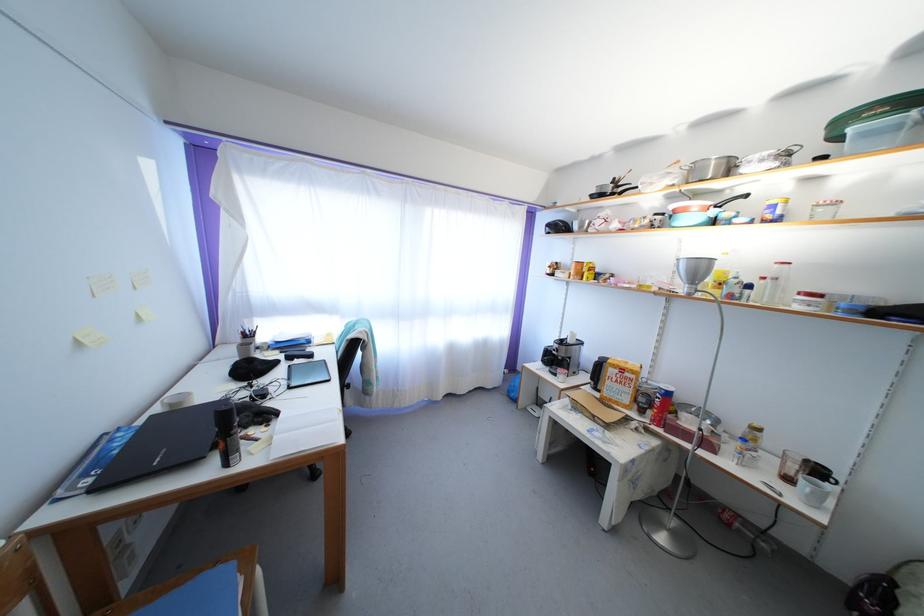
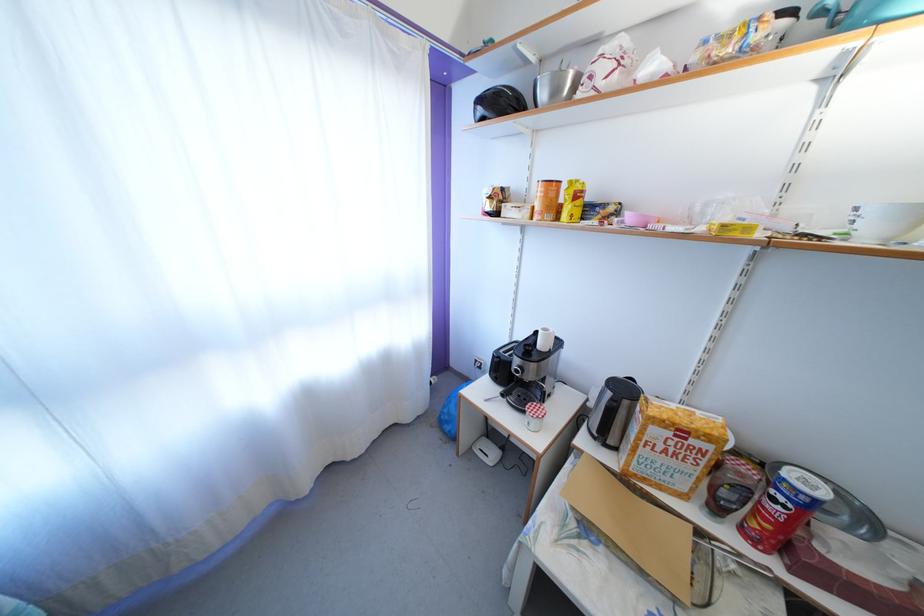
The point at (x=553, y=232) is marked in the first image. Where is the corresponding point in the second image?

(484, 107)